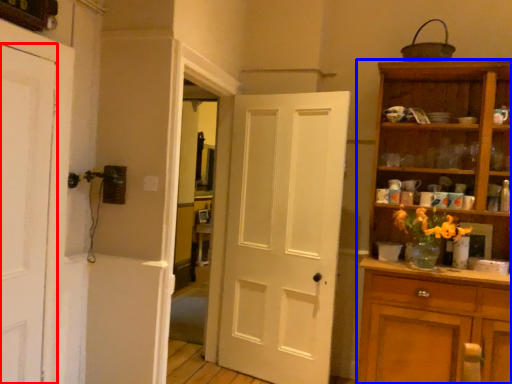
Question: Among these objects, which one is nearest to the camera, door (highlighted by a red box) or cupboard (highlighted by a blue box)?

Choices:
 (A) door
 (B) cupboard

Answer: (A)